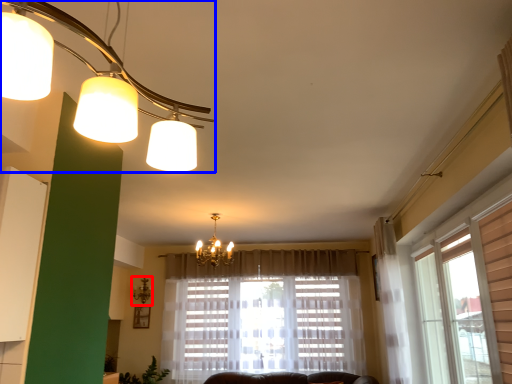
Question: Which object appears closest to the camera in this image, lamp (highlighted by a red box) or lamp (highlighted by a blue box)?

Choices:
 (A) lamp
 (B) lamp

Answer: (B)